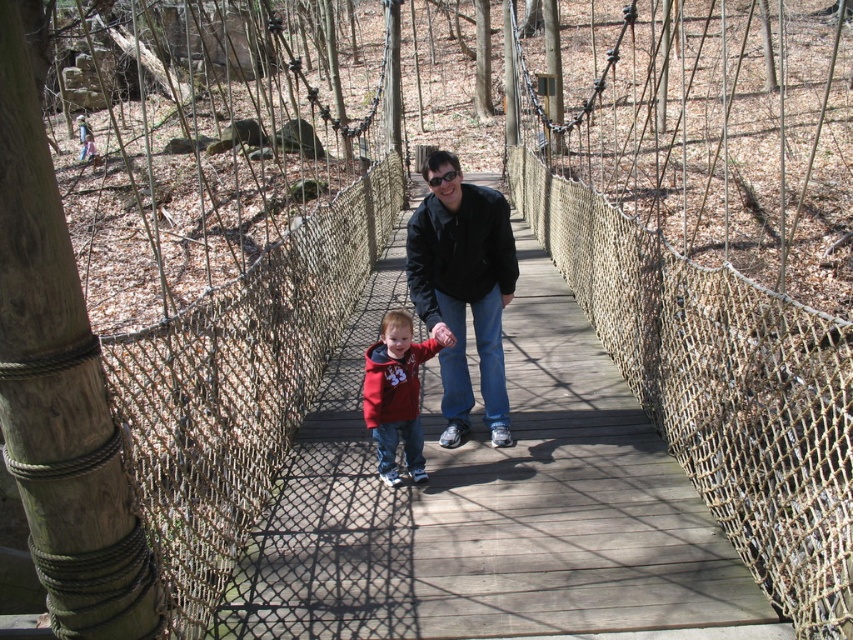
Is point (439, 216) closer to camera compared to point (401, 369)?

No, (439, 216) is further to viewer.

Does matte black jacket at center appear on the left side of matte red hoodie at center?

Incorrect, matte black jacket at center is not on the left side of matte red hoodie at center.

Image resolution: width=853 pixels, height=640 pixels. Find the location of `matte black jacket at center`. matte black jacket at center is located at coordinates (463, 289).